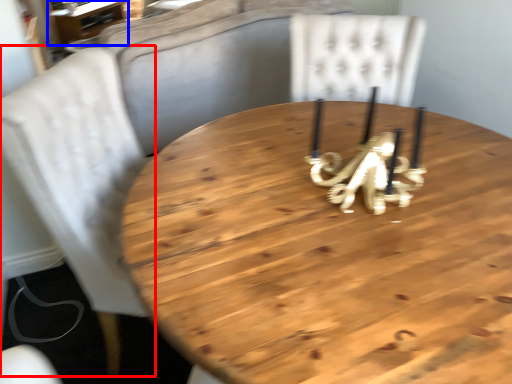
Question: Which object appears closest to the camera in this image, chair (highlighted by a red box) or table (highlighted by a blue box)?

Choices:
 (A) chair
 (B) table

Answer: (A)